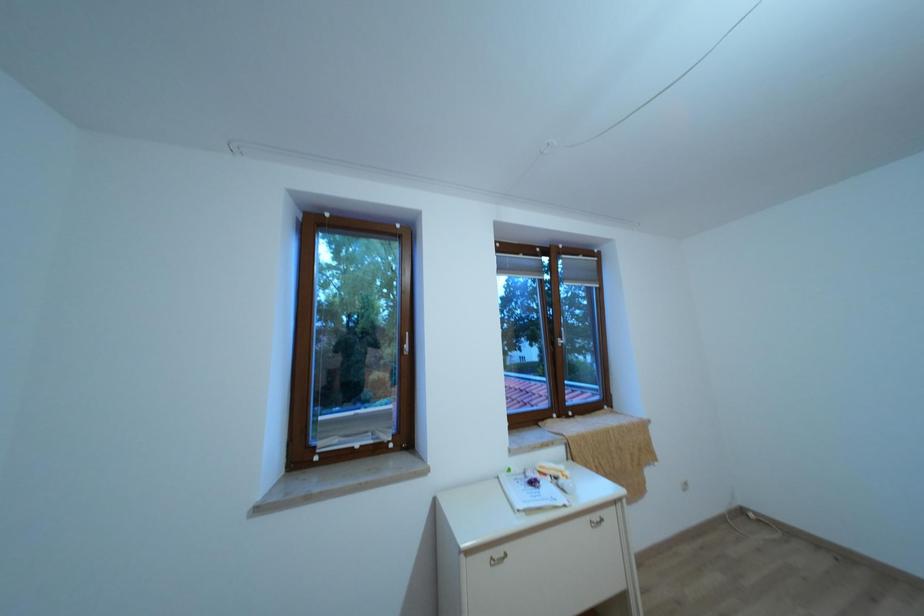
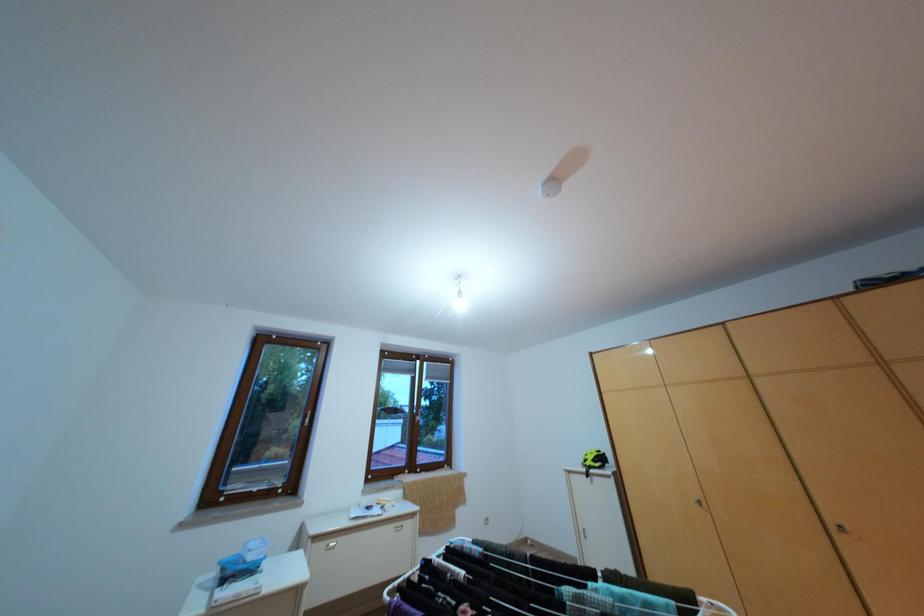
Question: What movement of the cameraman would produce the second image?

Choices:
 (A) Left
 (B) Right
 (C) Forward
 (D) Backward

Answer: (D)